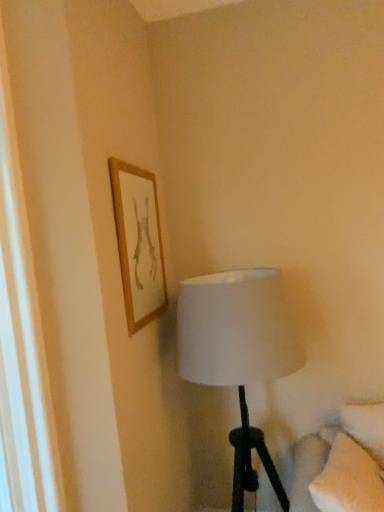
I want to click on wooden frame at upper left, so click(138, 243).

This screenshot has height=512, width=384. What do you see at coordinates (138, 243) in the screenshot?
I see `wooden frame at upper left` at bounding box center [138, 243].

Locate an element on the screen. wooden frame at upper left is located at coordinates (138, 243).